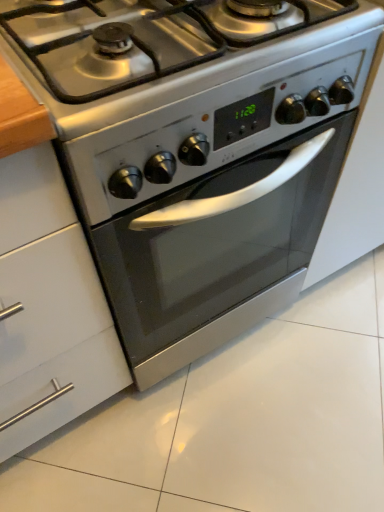
I want to click on white glossy cabinet at left, so click(x=48, y=307).

The image size is (384, 512). What do you see at coordinates (48, 307) in the screenshot?
I see `white glossy cabinet at left` at bounding box center [48, 307].

What do you see at coordinates (185, 79) in the screenshot? I see `satin silver gas stove at center` at bounding box center [185, 79].

This screenshot has height=512, width=384. Identify the location of satin silver gas stove at center. (185, 79).

This screenshot has width=384, height=512. I want to click on white glossy cabinet at left, so click(x=48, y=307).

Is satin silver gas stove at center to the right of white glossy cabinet at left from the viewer's perspective?

Indeed, satin silver gas stove at center is positioned on the right side of white glossy cabinet at left.

Based on the photo, in the image, is satin silver gas stove at center positioned in front of or behind white glossy cabinet at left?

Visually, satin silver gas stove at center is located behind white glossy cabinet at left.

Considering the positions of point (178, 56) and point (112, 394), is point (178, 56) closer or farther from the camera than point (112, 394)?

Point (178, 56) is closer to the camera than point (112, 394).

From the image's perspective, is satin silver gas stove at center below white glossy cabinet at left?

Actually, satin silver gas stove at center appears above white glossy cabinet at left in the image.

From a real-world perspective, is satin silver gas stove at center on top of white glossy cabinet at left?

Yes.

From the picture: Looking at their sizes, would you say satin silver gas stove at center is wider or thinner than white glossy cabinet at left?

Considering their sizes, satin silver gas stove at center looks slimmer than white glossy cabinet at left.

Considering the sizes of satin silver gas stove at center and white glossy cabinet at left in the image, is satin silver gas stove at center taller or shorter than white glossy cabinet at left?

In the image, satin silver gas stove at center appears to be shorter than white glossy cabinet at left.

Considering the relative sizes of satin silver gas stove at center and white glossy cabinet at left in the image provided, is satin silver gas stove at center smaller than white glossy cabinet at left?

Indeed, satin silver gas stove at center has a smaller size compared to white glossy cabinet at left.

Is white glossy cabinet at left completely or partially inside satin silver gas stove at center?

No.

Does satin silver gas stove at center touch white glossy cabinet at left?

satin silver gas stove at center is not next to white glossy cabinet at left, and they're not touching.

Is satin silver gas stove at center facing away from white glossy cabinet at left?

That's not correct — satin silver gas stove at center is not looking away from white glossy cabinet at left.

How many degrees apart are the facing directions of satin silver gas stove at center and white glossy cabinet at left?

They differ by 0.0646 degrees in their facing directions.

Image resolution: width=384 pixels, height=512 pixels. Find the location of `gas stove located above the white glossy cabinet at left (from a real-world perspective)`. gas stove located above the white glossy cabinet at left (from a real-world perspective) is located at coordinates (185, 79).

Considering the positions of objects white glossy cabinet at left and satin silver gas stove at center in the image provided, who is more to the left, white glossy cabinet at left or satin silver gas stove at center?

white glossy cabinet at left.

Which object is further away from the camera taking this photo, white glossy cabinet at left or satin silver gas stove at center?

satin silver gas stove at center.

Which point is more distant from viewer, (59, 294) or (90, 91)?

The point (59, 294) is farther from the camera.

From the image's perspective, is white glossy cabinet at left on top of satin silver gas stove at center?

No, from the image's perspective, white glossy cabinet at left is not above satin silver gas stove at center.

From a real-world perspective, is white glossy cabinet at left on satin silver gas stove at center?

No.

Which of these two, white glossy cabinet at left or satin silver gas stove at center, is wider?

Wider between the two is white glossy cabinet at left.

In terms of height, does white glossy cabinet at left look taller or shorter compared to satin silver gas stove at center?

Clearly, white glossy cabinet at left is taller compared to satin silver gas stove at center.

Is white glossy cabinet at left smaller than satin silver gas stove at center?

Incorrect, white glossy cabinet at left is not smaller in size than satin silver gas stove at center.

Can we say white glossy cabinet at left lies outside satin silver gas stove at center?

white glossy cabinet at left is positioned outside satin silver gas stove at center.

Is white glossy cabinet at left with satin silver gas stove at center?

There is a gap between white glossy cabinet at left and satin silver gas stove at center.

Is satin silver gas stove at center at the back of white glossy cabinet at left?

No, white glossy cabinet at left is not facing away from satin silver gas stove at center.

How different are the orientations of white glossy cabinet at left and satin silver gas stove at center in degrees?

white glossy cabinet at left and satin silver gas stove at center are facing 0.0646 degrees away from each other.

You are a GUI agent. You are given a task and a screenshot of the screen. Output one action in this format:
    pyautogui.click(x=<x>, y=<y>)
    Task: Click on the gas stove above the white glossy cabinet at left (from a real-world perspective)
    The image size is (384, 512).
    Given the screenshot: What is the action you would take?
    pyautogui.click(x=185, y=79)

This screenshot has height=512, width=384. I want to click on gas stove behind the white glossy cabinet at left, so click(x=185, y=79).

Where is `gas stove located above the white glossy cabinet at left (from a real-world perspective)`? gas stove located above the white glossy cabinet at left (from a real-world perspective) is located at coordinates (185, 79).